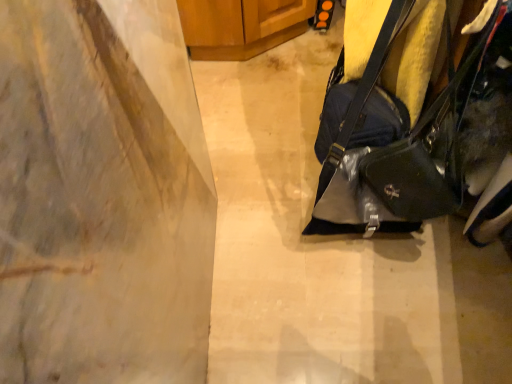
You are a GUI agent. You are given a task and a screenshot of the screen. Output one action in this format:
    pyautogui.click(x=<x>, y=<y>)
    Task: Click on the free spot above matte gray concrete at center (from a real-world perspective)
    
    Given the screenshot: What is the action you would take?
    pyautogui.click(x=294, y=201)